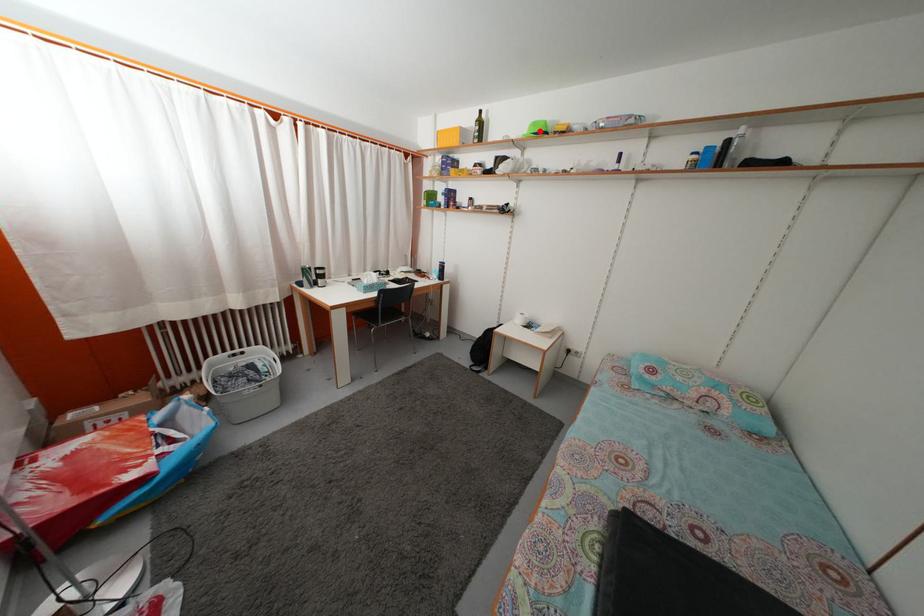
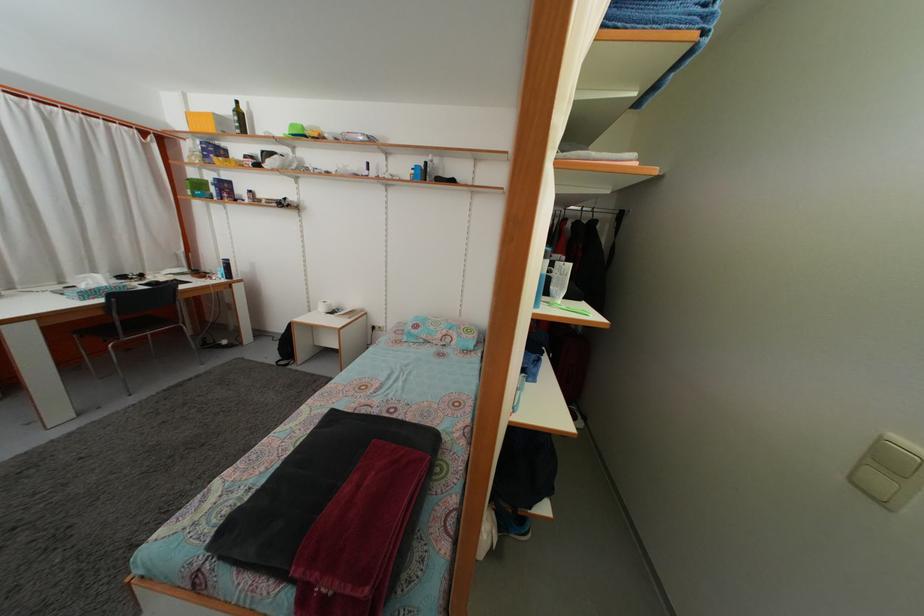
The point at the highlighted location is marked in the first image. Where is the corresponding point in the second image?

(298, 132)